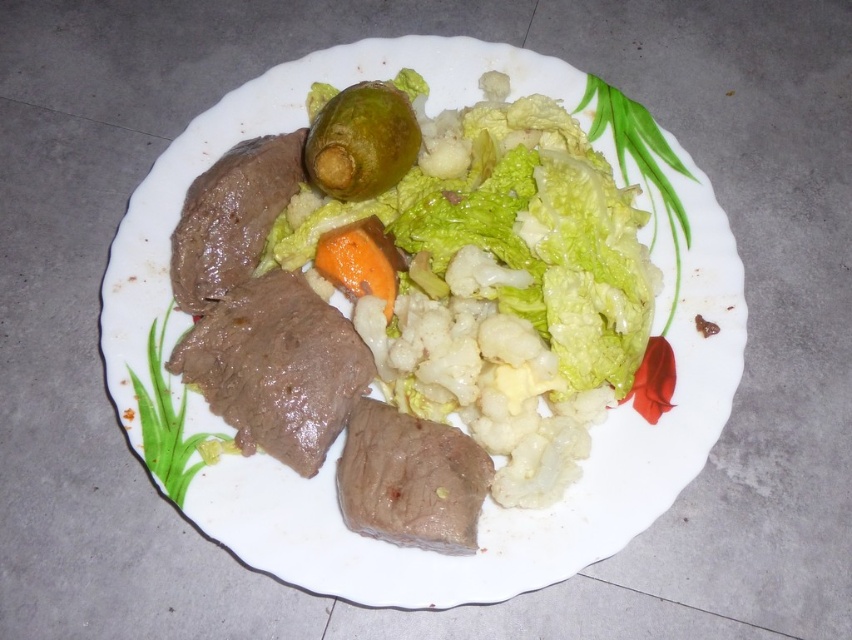
Which is more to the right, brown glossy meat at center or pinkish-brown raw meat at center?

Positioned to the right is pinkish-brown raw meat at center.

Who is higher up, brown glossy meat at center or pinkish-brown raw meat at center?

brown glossy meat at center

The height and width of the screenshot is (640, 852). Describe the element at coordinates (275, 365) in the screenshot. I see `brown glossy meat at center` at that location.

Find the location of a particular element. This screenshot has width=852, height=640. brown glossy meat at center is located at coordinates (275, 365).

Which is below, brown matte meat at upper left or green glossy pickle at center?

brown matte meat at upper left

Based on the photo, is brown matte meat at upper left shorter than green glossy pickle at center?

No, brown matte meat at upper left is not shorter than green glossy pickle at center.

Describe the element at coordinates (232, 216) in the screenshot. I see `brown matte meat at upper left` at that location.

Where is `brown matte meat at upper left`? The width and height of the screenshot is (852, 640). brown matte meat at upper left is located at coordinates (232, 216).

Looking at this image, between brown glossy meat at center and green glossy pickle at center, which one has more height?

brown glossy meat at center is taller.

Is point (229, 424) closer to camera compared to point (384, 150)?

Yes, it is.

At what (x,y) coordinates should I click in order to perform the action: click on brown glossy meat at center. Please return your answer as a coordinate pair (x, y). The image size is (852, 640). Looking at the image, I should click on (275, 365).